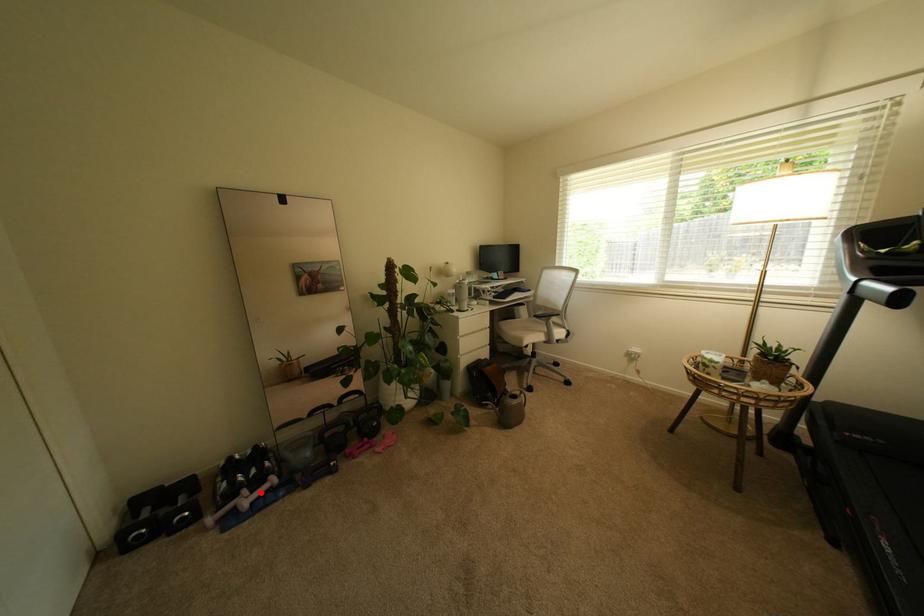
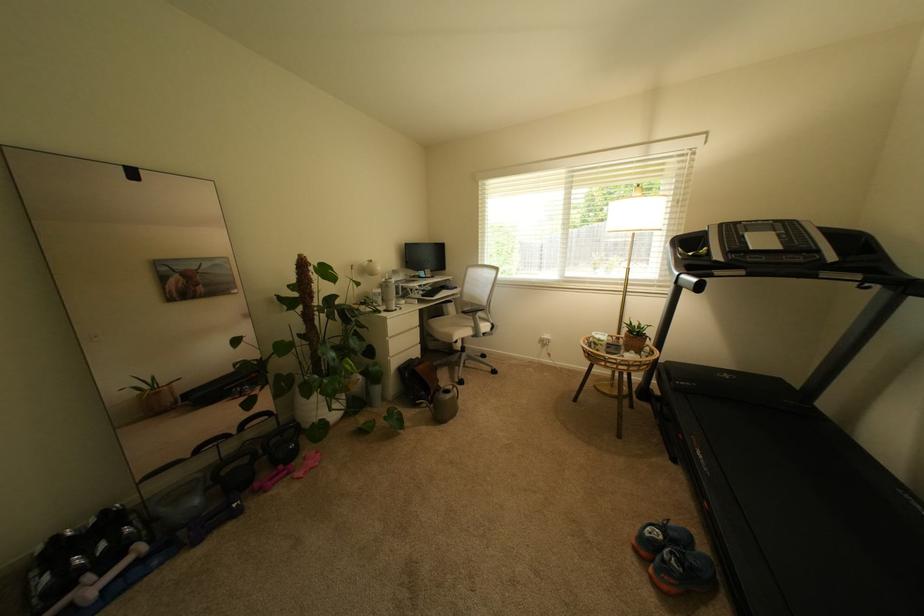
Question: A red point is marked in image1. In image2, is the corresponding 3D point closer to the camera or farther? Reply with the corresponding letter.

Choices:
 (A) The corresponding 3D point is closer.
 (B) The corresponding 3D point is farther.

Answer: (A)